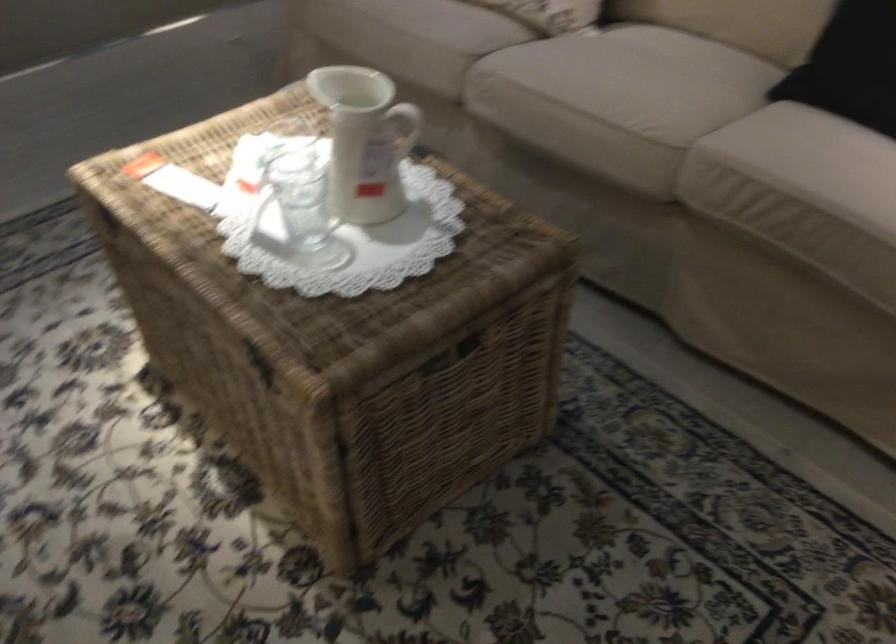
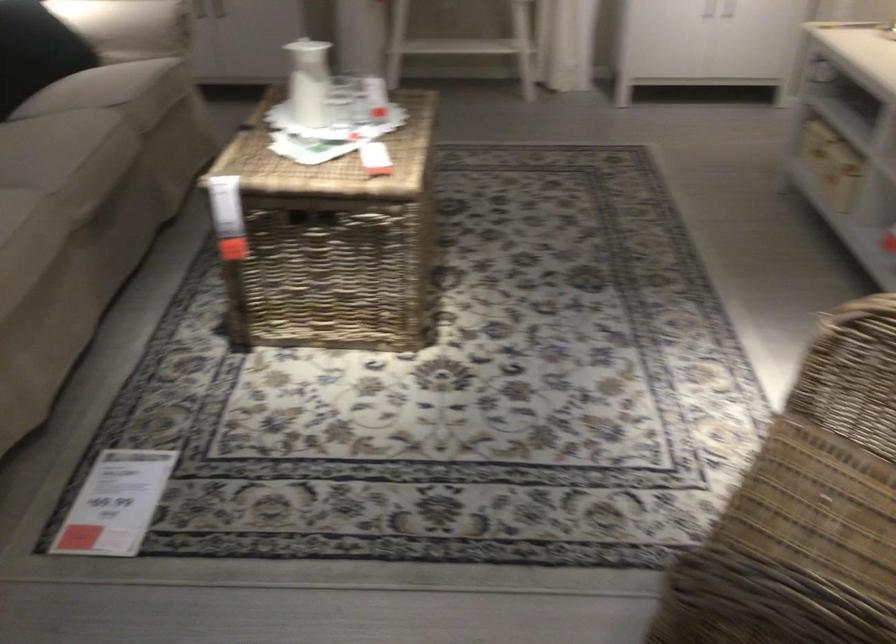
Where in the second image is the point corresponding to (236,178) from the first image?

(314, 216)